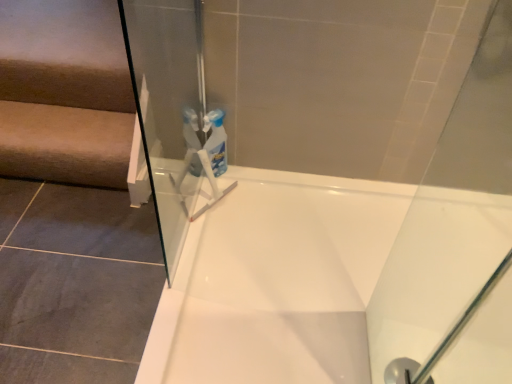
You are a GUI agent. You are given a task and a screenshot of the screen. Output one action in this format:
    pyautogui.click(x=<x>, y=<y>)
    Task: Click on the free space to the left of transparent glass shower at lower right
    This screenshot has width=512, height=384.
    Given the screenshot: What is the action you would take?
    pyautogui.click(x=338, y=354)